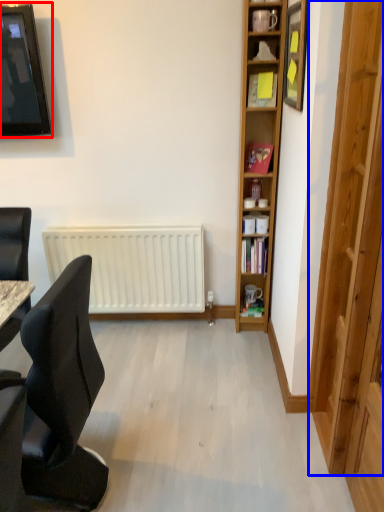
Question: Which object is further to the camera taking this photo, television (highlighted by a red box) or glass door (highlighted by a blue box)?

Choices:
 (A) television
 (B) glass door

Answer: (A)